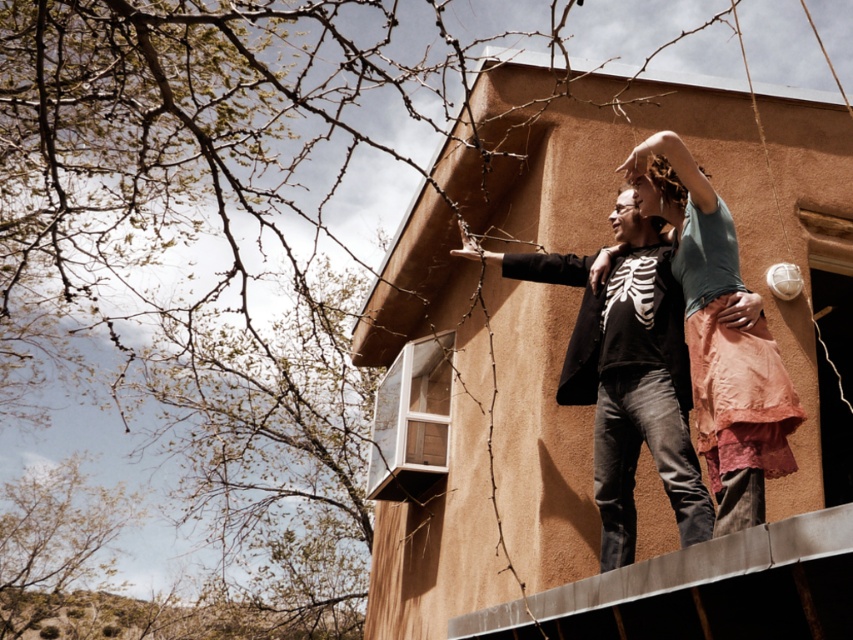
You are a photographer trying to capture the perfect shot of the matte black skeleton shirt at center. Based on its 2D coordinates, which part of the image should you focus on to ensure the shirt is in the frame?

The matte black skeleton shirt at center is located at the 2D coordinates point (627,376), so focusing on that point will ensure the shirt is centered in the frame.

You are a photographer trying to capture the perfect shot of the two people on the building. You notice the matte black skeleton shirt at center and the light blue cotton shirt at center. Which one is positioned lower in the image?

The matte black skeleton shirt at center is located below the light blue cotton shirt at center, so it is positioned lower in the image.

You are a fashion designer observing two shirts in the scene. The matte black skeleton shirt at center and the light blue cotton shirt at center. Which one has a larger size?

The matte black skeleton shirt at center is bigger than the light blue cotton shirt at center.